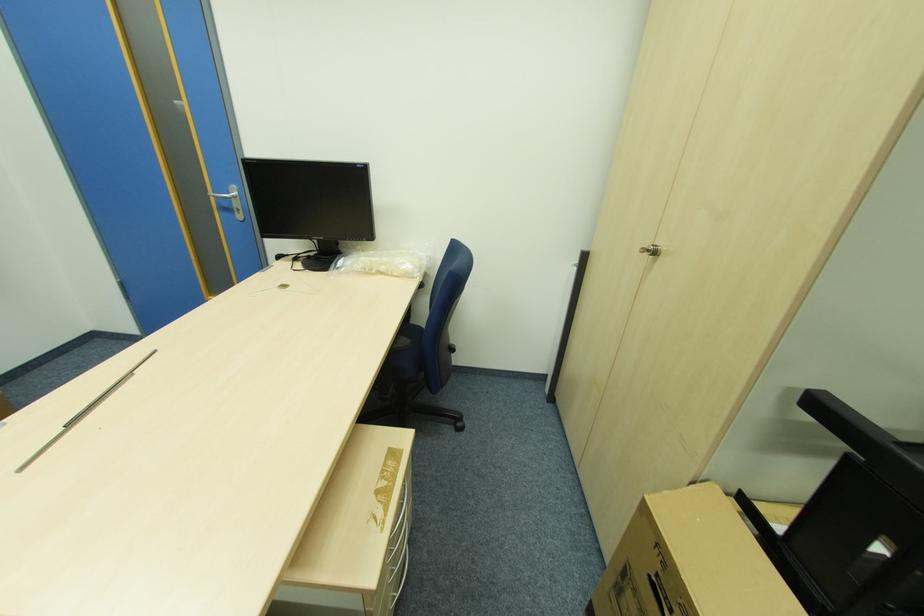
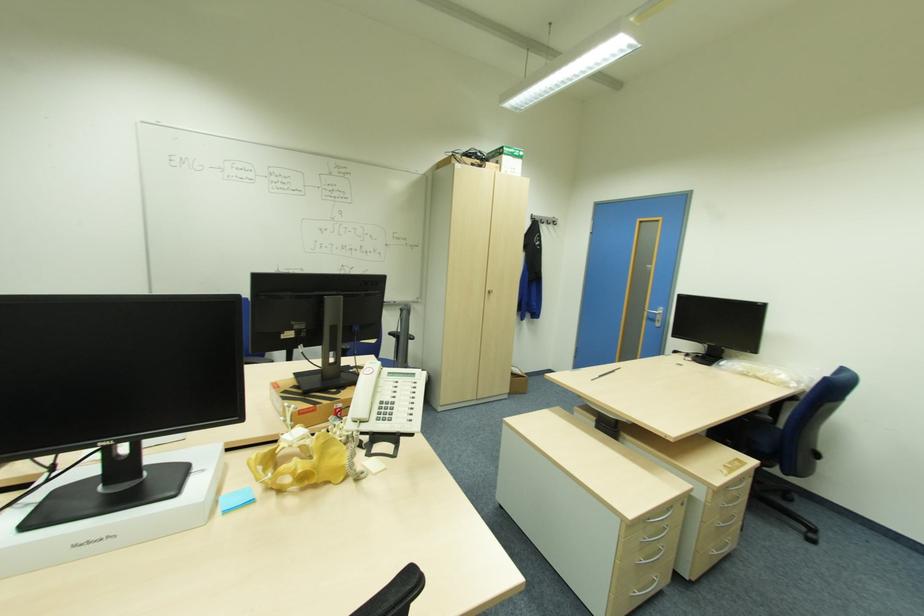
Locate, in the second image, the point that corresponds to (x=241, y=209) in the first image.

(661, 321)